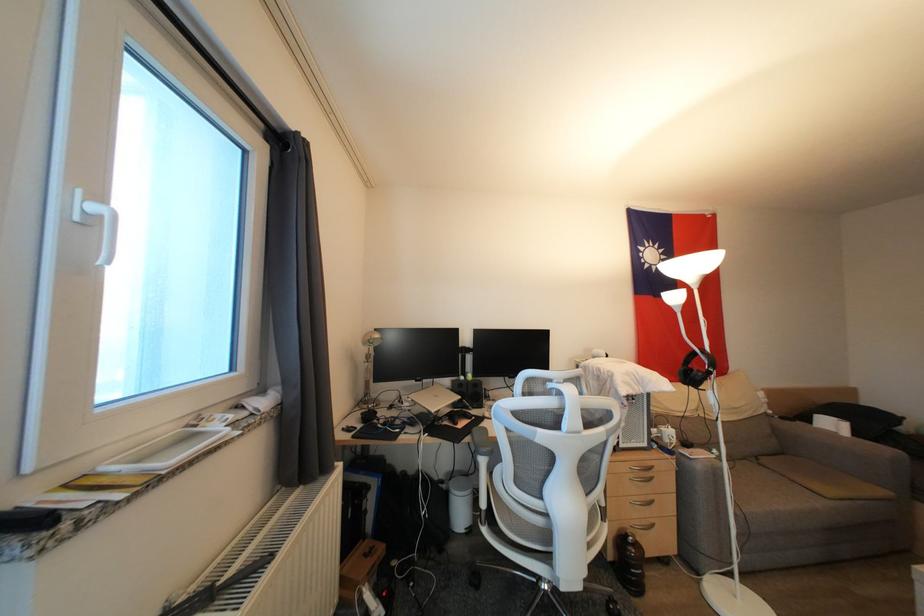
Where is `sofa armrest`? sofa armrest is located at coordinates pos(836,448).